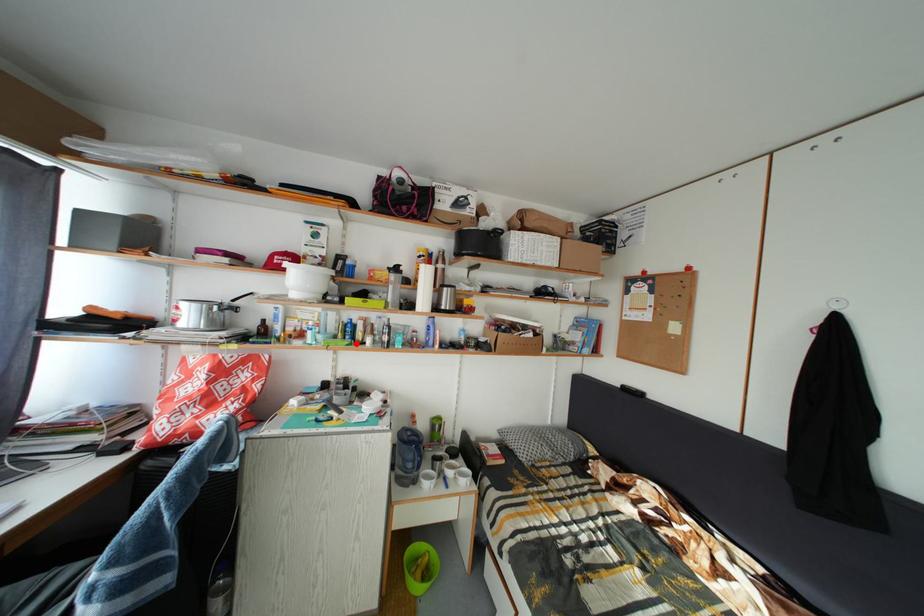
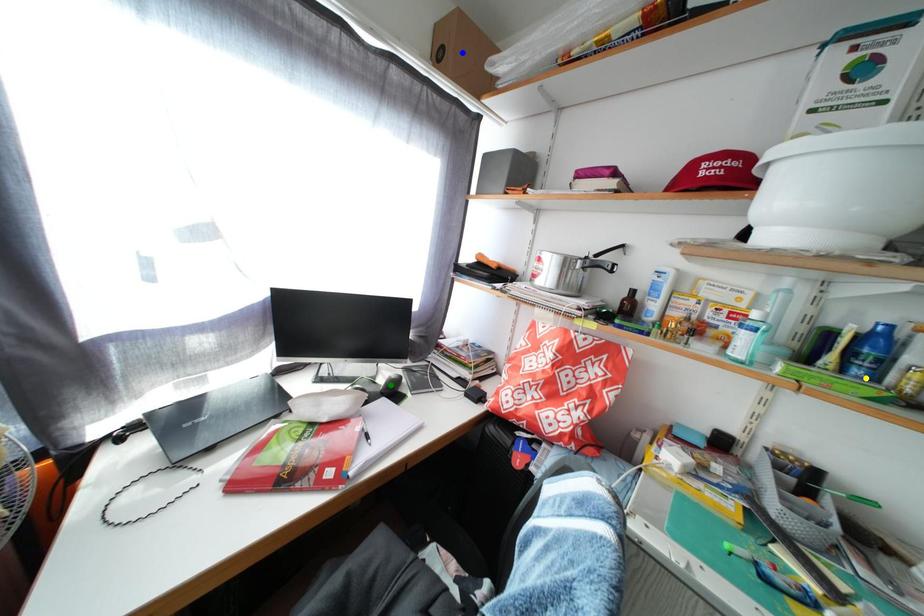
Question: I am providing you with two images of the same scene from different viewpoints. A red point is marked on the first image. You are given multiple points on the second image. Which point in image 2 represents the same 3d spot as the red point in image 1?

Choices:
 (A) blue point
 (B) green point
 (C) yellow point

Answer: (C)